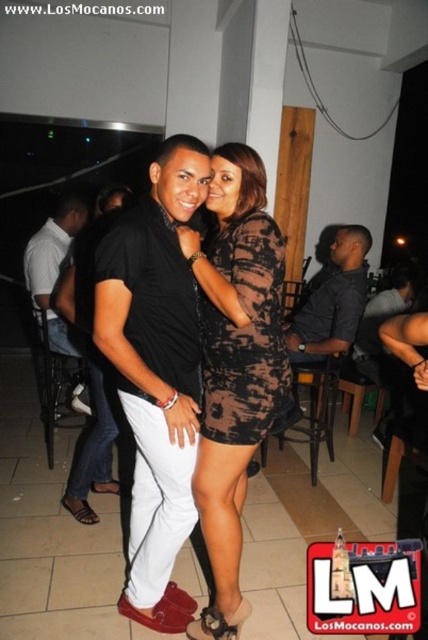
You are a photographer trying to capture a clear shot of both the matte black shirt at center and the black matte shirt at center. Since they are both at the center, which one should you focus on to ensure the smaller one is in sharp focus?

The matte black shirt at center is smaller than the black matte shirt at center, so to ensure the smaller one is in sharp focus, you should focus on the matte black shirt at center.

You are a photographer trying to capture a clear photo of the matte black shirt at center and the black textured dress at center. The camera you are using has a minimum focus distance of 10 inches. Can you focus on both subjects simultaneously?

The distance between the matte black shirt at center and the black textured dress at center is 10.01 inches, which is just over the camera minimum focus distance of 10 inches. Therefore, the camera can focus on both subjects simultaneously.